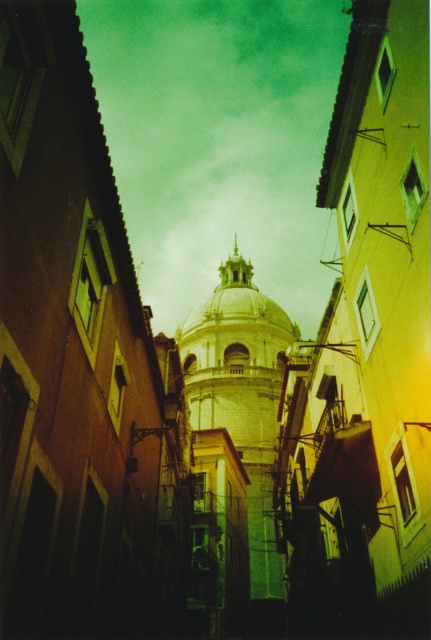
You are an architect planning to install a new light fixture between the white stone dome at center and the gold textured dome at center. Based on their positions, which dome should the light be placed closer to in order to illuminate both evenly?

The white stone dome at center is below the gold textured dome at center. To illuminate both evenly, the light should be placed closer to the white stone dome at center since it is lower and requires more light to reach the upper gold textured dome.

You are an architect designing a new building that needs to fit into the existing alleyway. The white stone dome at center and the gold textured dome at center are both part of the existing structures. Which dome would require a wider base to accommodate its structure?

The gold textured dome at center requires a wider base because it has a greater width compared to the white stone dome at center.

You are an architect planning to install a new light pole between the white stone dome at center and the gold textured dome at center. The light pole requires a minimum of 10 meters of space between the two domes to be installed safely. Based on the scene, can the light pole be placed there?

The white stone dome at center is 11.90 meters from the gold textured dome at center. Since the required minimum space is 10 meters, the light pole can be safely installed between them.